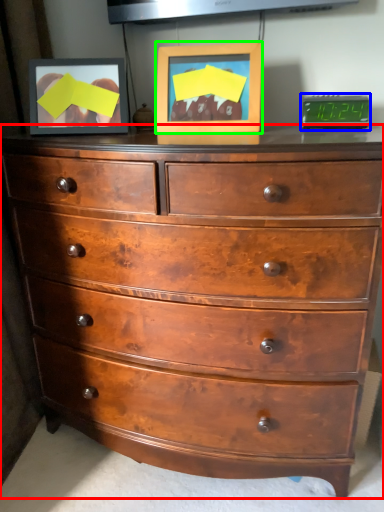
Question: Based on their relative distances, which object is nearer to chest of drawers (highlighted by a red box)? Choose from alarm clock (highlighted by a blue box) and picture frame (highlighted by a green box).

Choices:
 (A) alarm clock
 (B) picture frame

Answer: (B)